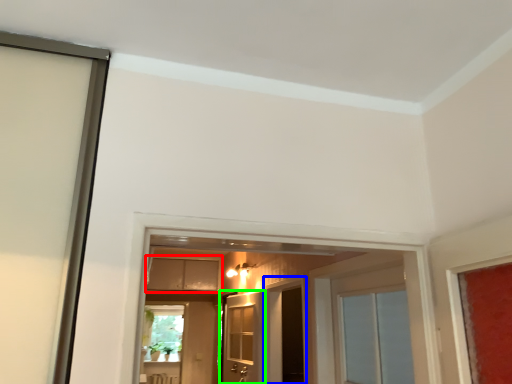
Question: Which object is the farthest from cabinetry (highlighted by a red box)? Choose among these: screen door (highlighted by a blue box) or door (highlighted by a green box).

Choices:
 (A) screen door
 (B) door

Answer: (A)